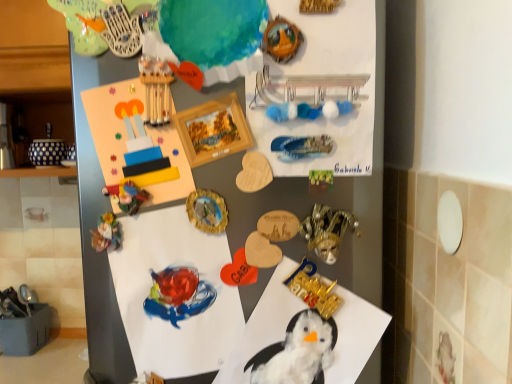
Question: From the image's perspective, would you say watercolor paper at center, placed as the second paper when sorted from bottom to top, is shown under white fluffy paper at center, which appears as the first paper when ordered from the bottom?

Choices:
 (A) yes
 (B) no

Answer: (B)

Question: From a real-world perspective, is watercolor paper at center, placed as the second paper when sorted from bottom to top, located beneath white fluffy paper at center, which appears as the first paper when ordered from the bottom?

Choices:
 (A) no
 (B) yes

Answer: (A)

Question: Is white fluffy paper at center, which appears as the third paper when viewed from the top, completely or partially inside watercolor paper at center, the 2th paper viewed from the top?

Choices:
 (A) yes
 (B) no

Answer: (B)

Question: Can you confirm if watercolor paper at center, the 2th paper viewed from the top, is positioned to the left of white fluffy paper at center, which appears as the first paper when ordered from the bottom?

Choices:
 (A) no
 (B) yes

Answer: (B)

Question: Considering the relative sizes of watercolor paper at center, placed as the second paper when sorted from bottom to top, and white fluffy paper at center, which appears as the third paper when viewed from the top, in the image provided, is watercolor paper at center, placed as the second paper when sorted from bottom to top, thinner than white fluffy paper at center, which appears as the third paper when viewed from the top,?

Choices:
 (A) yes
 (B) no

Answer: (A)

Question: From a real-world perspective, is gold metallic mask at center-right, the second toy in the bottom-to-top sequence, positioned above or below matte plastic toy at center-left, the first art in the top-to-bottom sequence?

Choices:
 (A) below
 (B) above

Answer: (A)

Question: Is gold metallic mask at center-right, the first toy in the top-to-bottom sequence, inside the boundaries of matte plastic toy at center-left, which ranks as the 2th art in bottom-to-top order, or outside?

Choices:
 (A) outside
 (B) inside

Answer: (A)

Question: Does point (328, 216) appear closer or farther from the camera than point (135, 193)?

Choices:
 (A) closer
 (B) farther

Answer: (A)

Question: Looking at their shapes, would you say gold metallic mask at center-right, the second toy in the bottom-to-top sequence, is wider or thinner than matte plastic toy at center-left, which ranks as the 2th art in bottom-to-top order?

Choices:
 (A) wide
 (B) thin

Answer: (B)

Question: Relative to porcelain figurine at lower left, arranged as the first art when ordered from the bottom, is wooden postcard at upper center in front or behind?

Choices:
 (A) behind
 (B) front

Answer: (B)

Question: Considering the positions of point (162, 187) and point (111, 215), is point (162, 187) closer or farther from the camera than point (111, 215)?

Choices:
 (A) farther
 (B) closer

Answer: (B)

Question: From the image's perspective, is wooden postcard at upper center above or below porcelain figurine at lower left, arranged as the first art when ordered from the bottom?

Choices:
 (A) above
 (B) below

Answer: (A)

Question: In terms of height, does wooden postcard at upper center look taller or shorter compared to porcelain figurine at lower left, arranged as the first art when ordered from the bottom?

Choices:
 (A) short
 (B) tall

Answer: (B)

Question: From a real-world perspective, relative to porcelain figurine at lower left, arranged as the first art when ordered from the bottom, is gold metallic mask at center-right, the first toy in the top-to-bottom sequence, vertically above or below?

Choices:
 (A) below
 (B) above

Answer: (A)

Question: Choose the correct answer: Is gold metallic mask at center-right, the first toy in the top-to-bottom sequence, inside porcelain figurine at lower left, arranged as the first art when ordered from the bottom, or outside it?

Choices:
 (A) outside
 (B) inside

Answer: (A)